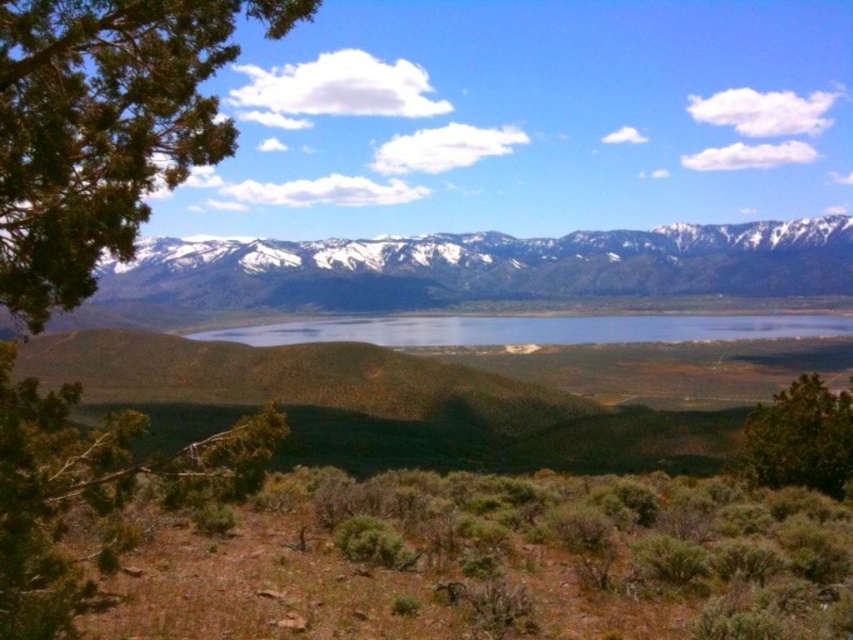
Can you confirm if green leafy tree at left is wider than green leafy tree at lower right?

No.

Is green leafy tree at left shorter than green leafy tree at lower right?

Incorrect, green leafy tree at left's height does not fall short of green leafy tree at lower right's.

Identify the location of green leafy tree at left. This screenshot has width=853, height=640. [103, 128].

Locate an element on the screen. green leafy tree at left is located at coordinates (103, 128).

Does green leafy tree at left appear over clear blue water at center?

Correct, green leafy tree at left is located above clear blue water at center.

Measure the distance between green leafy tree at left and camera.

The distance of green leafy tree at left from camera is 10.29 meters.

The height and width of the screenshot is (640, 853). What are the coordinates of `green leafy tree at left` in the screenshot? It's located at (103, 128).

Which of these two, green leafy tree at left or snowy rock mountain range at upper center, stands taller?

snowy rock mountain range at upper center

Is green leafy tree at left shorter than snowy rock mountain range at upper center?

Correct, green leafy tree at left is not as tall as snowy rock mountain range at upper center.

Which is behind, point (96, 218) or point (376, 259)?

The point (376, 259) is behind.

Image resolution: width=853 pixels, height=640 pixels. Identify the location of green leafy tree at left. (103, 128).